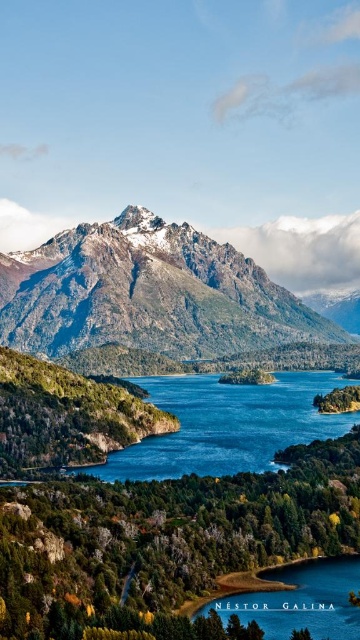
You are a hiker standing at the edge of the lake and want to determine which object in the scene is higher. You see the rocky gray mountain at center and the blue liquid water at center. Based on the scene, which one is taller?

The rocky gray mountain at center is much taller than the blue liquid water at center, so the mountain is taller.

Based on the photo, you are a hiker standing at the edge of the forest, looking out at the scene. You notice the rocky gray mountain at center and the blue liquid water at center. Which object is positioned to the left of the other?

The rocky gray mountain at center is to the left of the blue liquid water at center.